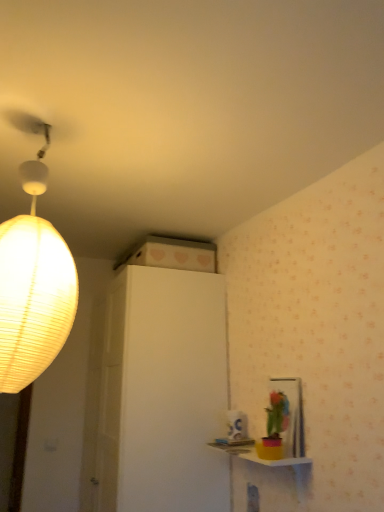
Question: Is yellow matte table at lower right taller than matte paper lampshade at left?

Choices:
 (A) yes
 (B) no

Answer: (B)

Question: From a real-world perspective, does yellow matte table at lower right sit lower than matte paper lampshade at left?

Choices:
 (A) no
 (B) yes

Answer: (B)

Question: Is yellow matte table at lower right touching matte paper lampshade at left?

Choices:
 (A) no
 (B) yes

Answer: (A)

Question: Considering the relative positions of yellow matte table at lower right and matte paper lampshade at left in the image provided, is yellow matte table at lower right in front of matte paper lampshade at left?

Choices:
 (A) no
 (B) yes

Answer: (A)

Question: Is yellow matte table at lower right to the left of matte paper lampshade at left from the viewer's perspective?

Choices:
 (A) yes
 (B) no

Answer: (B)

Question: Are yellow matte table at lower right and matte paper lampshade at left far apart?

Choices:
 (A) yes
 (B) no

Answer: (A)

Question: From a real-world perspective, is matte paper lampshade at left located beneath yellow matte table at lower right?

Choices:
 (A) yes
 (B) no

Answer: (B)

Question: Does matte paper lampshade at left have a lesser width compared to yellow matte table at lower right?

Choices:
 (A) no
 (B) yes

Answer: (A)

Question: Can you confirm if matte paper lampshade at left is taller than yellow matte table at lower right?

Choices:
 (A) yes
 (B) no

Answer: (A)

Question: Is matte paper lampshade at left facing towards yellow matte table at lower right?

Choices:
 (A) yes
 (B) no

Answer: (B)

Question: Is matte paper lampshade at left closer to camera compared to yellow matte table at lower right?

Choices:
 (A) yes
 (B) no

Answer: (A)

Question: Considering the relative positions of matte paper lampshade at left and yellow matte table at lower right in the image provided, is matte paper lampshade at left to the left of yellow matte table at lower right from the viewer's perspective?

Choices:
 (A) no
 (B) yes

Answer: (B)

Question: Is matte paper lampshade at left wider or thinner than yellow matte table at lower right?

Choices:
 (A) wide
 (B) thin

Answer: (A)